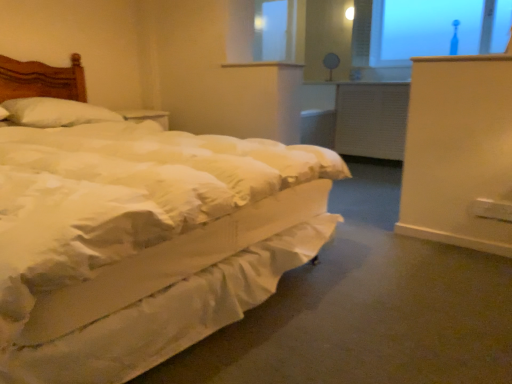
Question: From their relative heights in the image, would you say white soft bed at left is taller or shorter than white textured radiator at center?

Choices:
 (A) tall
 (B) short

Answer: (A)

Question: Is white soft bed at left in front of or behind white textured radiator at center in the image?

Choices:
 (A) front
 (B) behind

Answer: (A)

Question: Based on their relative distances, which object is nearer to the transparent glass window at upper right?

Choices:
 (A) white soft pillow at left
 (B) white soft bed at left
 (C) matte white table lamp at upper center
 (D) white textured radiator at center

Answer: (D)

Question: Based on their relative distances, which object is nearer to the transparent glass window at upper right?

Choices:
 (A) white textured radiator at center
 (B) white soft bed at left
 (C) matte white table lamp at upper center
 (D) white soft pillow at left

Answer: (A)